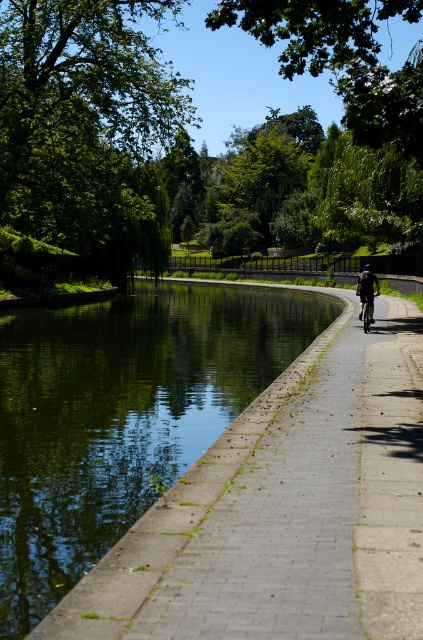
You are standing at the point marked by the coordinates (120, 417) in this riverside scene. Can you describe what you see around you?

The green concrete river at center is located at point (120, 417), so you are standing at the edge of the green concrete river at center. The river is calm and reflective, with dark green water mirroring the surroundings. To your right, the paved pathway runs parallel to the river, bordered by a low concrete wall. A cyclist is riding along the path, and the area has a serene, natural atmosphere under bright daylight.

You are standing at the riverside and want to take a photo of the green concrete river at center. If your camera has a maximum focus range of 6 meters, will it be able to capture the river clearly?

The green concrete river at center is 6.22 meters away from the camera. Since the maximum focus range is 6 meters, the camera cannot capture the river clearly at this distance.